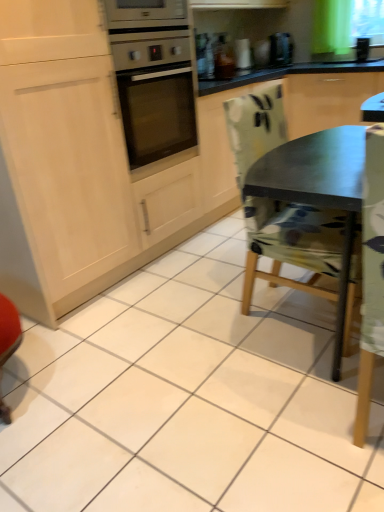
Question: Does point (248, 50) appear closer or farther from the camera than point (243, 162)?

Choices:
 (A) closer
 (B) farther

Answer: (B)

Question: Considering the positions of metallic silver toaster at upper center and camouflage fabric chair at center in the image, is metallic silver toaster at upper center bigger or smaller than camouflage fabric chair at center?

Choices:
 (A) big
 (B) small

Answer: (B)

Question: Estimate the real-world distances between objects in this image. Which object is farther from the black plastic coffee machine at upper center?

Choices:
 (A) metallic silver toaster at upper center
 (B) camouflage fabric chair at center

Answer: (B)

Question: Which is nearer to the metallic silver toaster at upper center?

Choices:
 (A) black plastic coffee machine at upper center
 (B) camouflage fabric chair at center

Answer: (A)